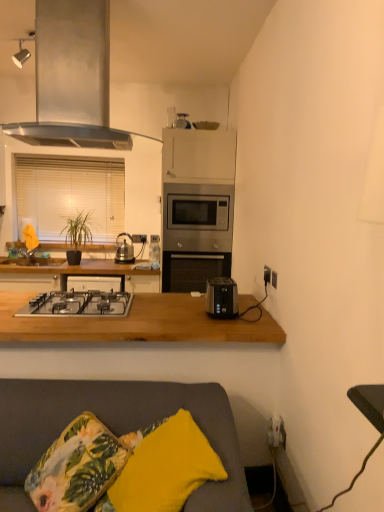
Question: Is white blinds at left positioned in front of black plastic socket at right, which ranks as the 2th electric outlet in left-to-right order?

Choices:
 (A) no
 (B) yes

Answer: (A)

Question: Is white blinds at left wider than black plastic socket at right, which ranks as the 2th electric outlet in left-to-right order?

Choices:
 (A) yes
 (B) no

Answer: (A)

Question: Is white blinds at left far from black plastic socket at right, the 2th electric outlet in the back-to-front sequence?

Choices:
 (A) yes
 (B) no

Answer: (A)

Question: From a real-world perspective, does white blinds at left sit lower than black plastic socket at right, the 2th electric outlet in the back-to-front sequence?

Choices:
 (A) no
 (B) yes

Answer: (A)

Question: From a real-world perspective, is white blinds at left positioned over black plastic socket at right, which ranks as the 2th electric outlet in left-to-right order, based on gravity?

Choices:
 (A) yes
 (B) no

Answer: (A)

Question: From a real-world perspective, is yellow fabric pillow at lower center physically located above or below stainless steel range hood at upper left?

Choices:
 (A) above
 (B) below

Answer: (B)

Question: Is point (155, 446) closer or farther from the camera than point (102, 25)?

Choices:
 (A) closer
 (B) farther

Answer: (A)

Question: Looking at their shapes, would you say yellow fabric pillow at lower center is wider or thinner than stainless steel range hood at upper left?

Choices:
 (A) thin
 (B) wide

Answer: (A)

Question: Considering the relative positions of yellow fabric pillow at lower center and stainless steel range hood at upper left in the image provided, is yellow fabric pillow at lower center to the left or to the right of stainless steel range hood at upper left?

Choices:
 (A) left
 (B) right

Answer: (B)

Question: Relative to white blinds at left, is white plastic electrical outlet at center, positioned as the first electric outlet in left-to-right order, in front or behind?

Choices:
 (A) behind
 (B) front

Answer: (A)

Question: Is point (157, 237) positioned closer to the camera than point (64, 176)?

Choices:
 (A) farther
 (B) closer

Answer: (B)

Question: Based on their sizes in the image, would you say white plastic electrical outlet at center, placed as the second electric outlet when sorted from bottom to top, is bigger or smaller than white blinds at left?

Choices:
 (A) small
 (B) big

Answer: (A)

Question: Is white plastic electrical outlet at center, which is the 2th electric outlet from front to back, situated inside white blinds at left or outside?

Choices:
 (A) outside
 (B) inside

Answer: (A)

Question: In terms of size, does wooden at lower center appear bigger or smaller than gray fabric couch at lower center?

Choices:
 (A) big
 (B) small

Answer: (B)

Question: From their relative heights in the image, would you say wooden at lower center is taller or shorter than gray fabric couch at lower center?

Choices:
 (A) short
 (B) tall

Answer: (A)